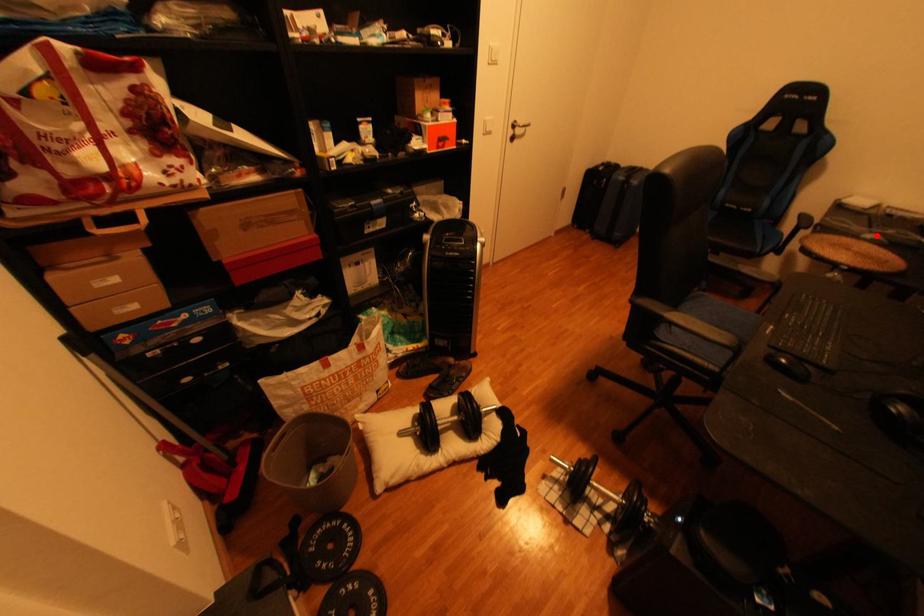
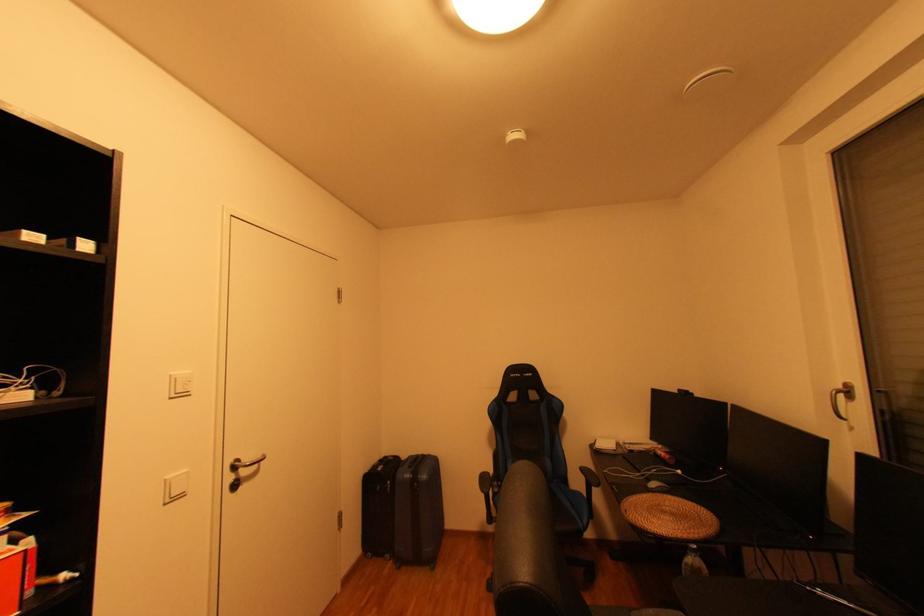
Locate, in the second image, the point that corresponds to the highlighted location in the first image.

(663, 485)